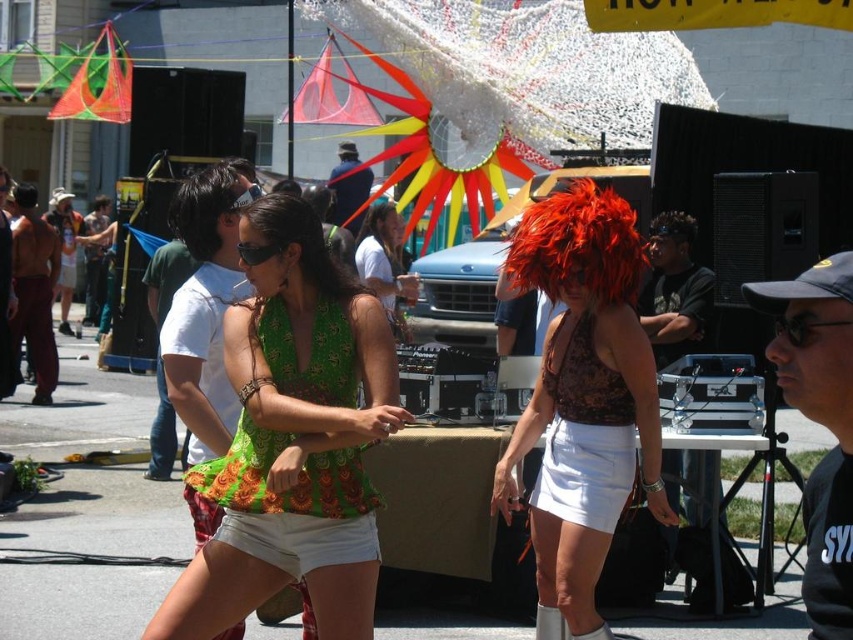
Question: Estimate the real-world distances between objects in this image. Which object is farther from the green floral tank top at center?

Choices:
 (A) green floral blouse at center
 (B) satin black top at center
 (C) shiny red wig at center
 (D) white cotton shorts at center

Answer: (C)

Question: Observing the image, what is the correct spatial positioning of white cotton shorts at center in reference to green floral tank top at center?

Choices:
 (A) left
 (B) right

Answer: (A)

Question: Which point is farther to the camera?

Choices:
 (A) satin black top at center
 (B) green floral tank top at center
 (C) green floral blouse at center
 (D) white cotton shorts at center

Answer: (B)

Question: Which of the following is the farthest from the observer?

Choices:
 (A) satin black top at center
 (B) white cotton shorts at center

Answer: (A)

Question: Considering the relative positions of shiny red wig at center and white cotton shorts at center in the image provided, where is shiny red wig at center located with respect to white cotton shorts at center?

Choices:
 (A) right
 (B) left

Answer: (A)

Question: Is shiny red wig at center further to the viewer compared to green floral tank top at center?

Choices:
 (A) yes
 (B) no

Answer: (A)